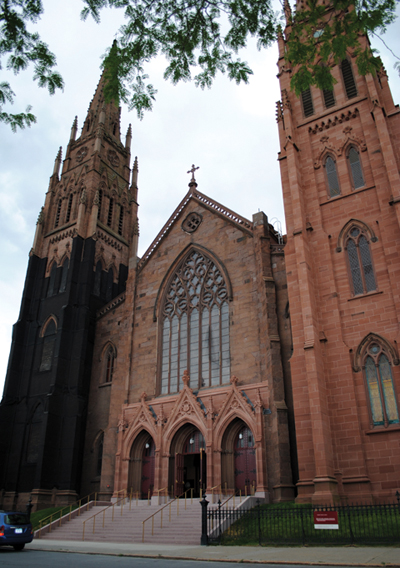
Identify the location of stairs. Image resolution: width=400 pixels, height=568 pixels. (135, 519).